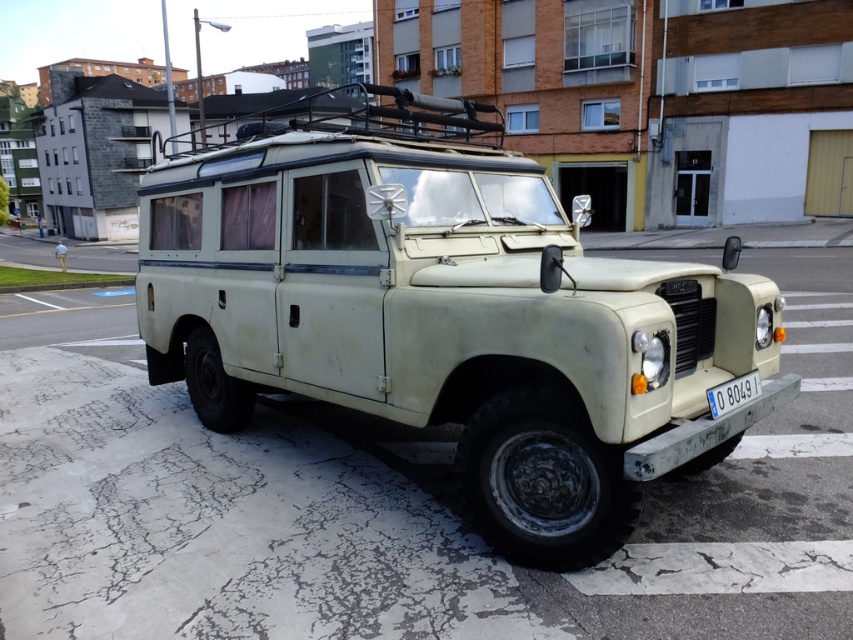
Which is in front, point (660, 275) or point (753, 387)?

Point (660, 275)

Is matte cream jeep at center above white plastic license plate at lower center?

Correct, matte cream jeep at center is located above white plastic license plate at lower center.

Locate an element on the screen. The image size is (853, 640). matte cream jeep at center is located at coordinates (447, 314).